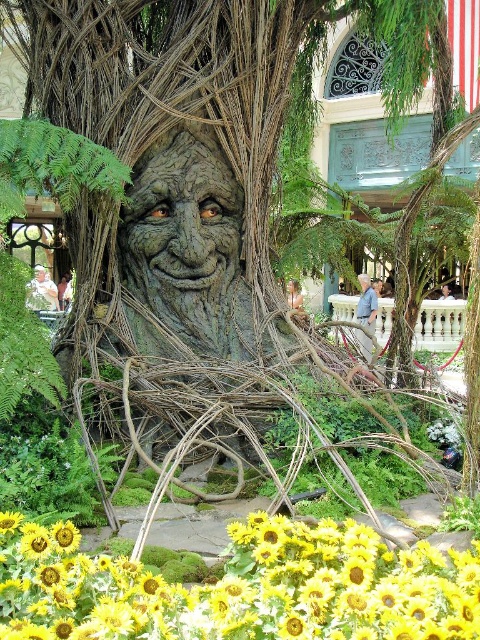
Question: Does yellow matte sunflower at center come behind green mossy tree trunk at center?

Choices:
 (A) no
 (B) yes

Answer: (A)

Question: Which object appears closest to the camera in this image?

Choices:
 (A) green mossy tree trunk at center
 (B) yellow matte sunflower at center

Answer: (B)

Question: Which point is farther to the camera?

Choices:
 (A) (191, 612)
 (B) (167, 157)

Answer: (B)

Question: Which point is closer to the camera taking this photo?

Choices:
 (A) pos(158,177)
 (B) pos(389,624)

Answer: (B)

Question: Is yellow matte sunflower at center smaller than green mossy tree trunk at center?

Choices:
 (A) yes
 (B) no

Answer: (B)

Question: Does yellow matte sunflower at center appear on the left side of green mossy tree trunk at center?

Choices:
 (A) no
 (B) yes

Answer: (A)